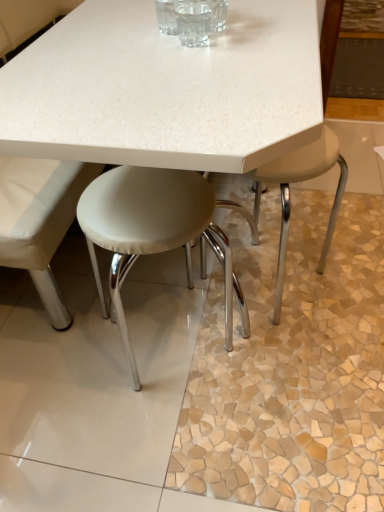
Question: From a real-world perspective, is transparent glass at center physically located above or below white leather stool at center, marked as the 2th stool in a right-to-left arrangement?

Choices:
 (A) below
 (B) above

Answer: (B)

Question: In terms of height, does transparent glass at center look taller or shorter compared to white leather stool at center, marked as the 2th stool in a right-to-left arrangement?

Choices:
 (A) short
 (B) tall

Answer: (A)

Question: Which object is the closest to the transparent glass at center?

Choices:
 (A) white leather stool at center, marked as the 2th stool in a right-to-left arrangement
 (B) beige leather stool at lower right, acting as the second stool starting from the left

Answer: (A)

Question: Which object is positioned closest to the white leather stool at center, marked as the 2th stool in a right-to-left arrangement?

Choices:
 (A) beige leather stool at lower right, arranged as the first stool when viewed from the right
 (B) transparent glass at center

Answer: (B)